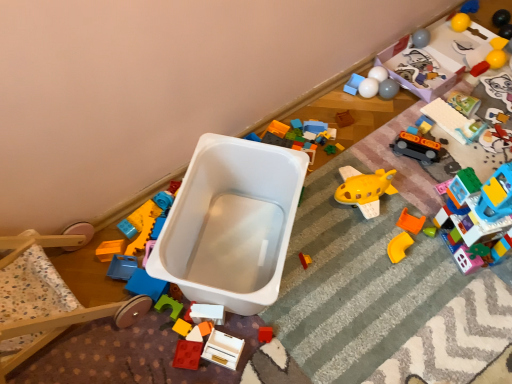
Image resolution: width=512 pixels, height=384 pixels. Find the location of `vacant space that's between orange matte plastic corner piece at lower right, the eighth toy positioned from the left, and rubberized red brick at lower center, positioned as the fifteenth toy in right-to-left order`. vacant space that's between orange matte plastic corner piece at lower right, the eighth toy positioned from the left, and rubberized red brick at lower center, positioned as the fifteenth toy in right-to-left order is located at coordinates (315, 291).